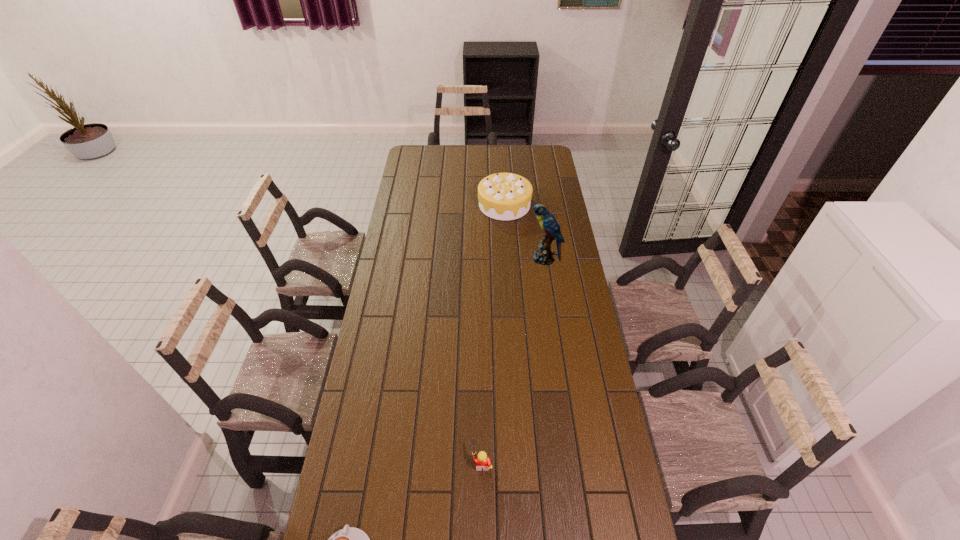
At what (x,y) coordinates should I click in order to perform the action: click on free spot located 0.250m in front of the third farthest object with the accessory visible. Please return your answer as a coordinate pair (x, y). Looking at the image, I should click on (391, 462).

Find the location of a particular element. The image size is (960, 540). vacant area situated 0.070m in front of the third farthest object with the accessory visible is located at coordinates coord(449,462).

Locate an element on the screen. object located at the right edge is located at coordinates (543, 255).

In the image, there is a desktop. Identify the location of vacant space at the far edge. (452, 164).

In the image, there is a desktop. Identify the location of free space at the left edge. The image size is (960, 540). 380,468.

Identify the location of vacant space at the right edge. This screenshot has width=960, height=540. (563, 286).

Find the location of `free spot between the birthday cake and the second nearest object`. free spot between the birthday cake and the second nearest object is located at coordinates tap(493, 333).

The width and height of the screenshot is (960, 540). Find the location of `empty location between the tallest object and the third farthest object`. empty location between the tallest object and the third farthest object is located at coordinates (513, 360).

The image size is (960, 540). What are the coordinates of `vacant space in between the parrot and the Lego` in the screenshot? It's located at (513, 360).

You are a GUI agent. You are given a task and a screenshot of the screen. Output one action in this format:
    pyautogui.click(x=<x>, y=<y>)
    Task: Click on the free space between the third farthest object and the third nearest object
    
    Given the screenshot: What is the action you would take?
    pyautogui.click(x=513, y=360)